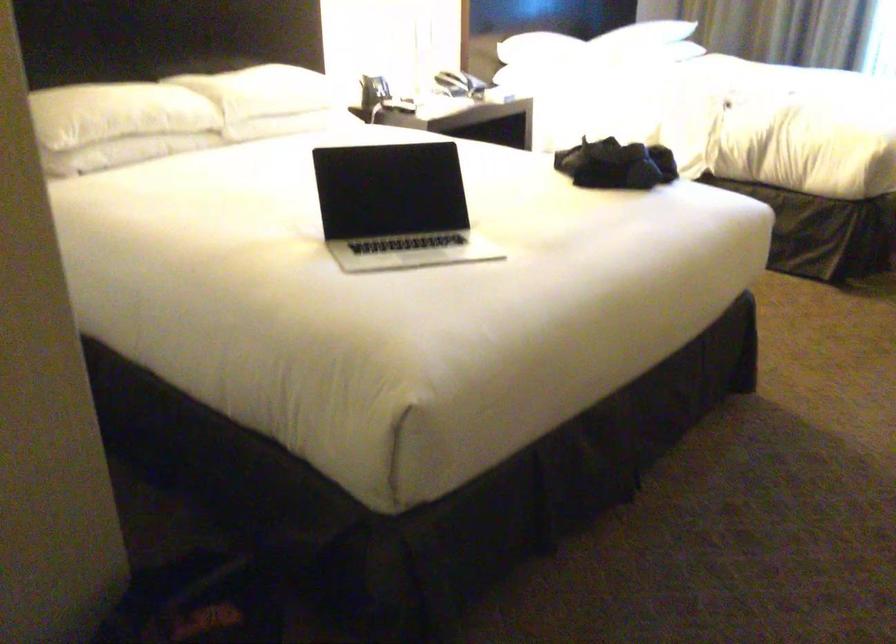
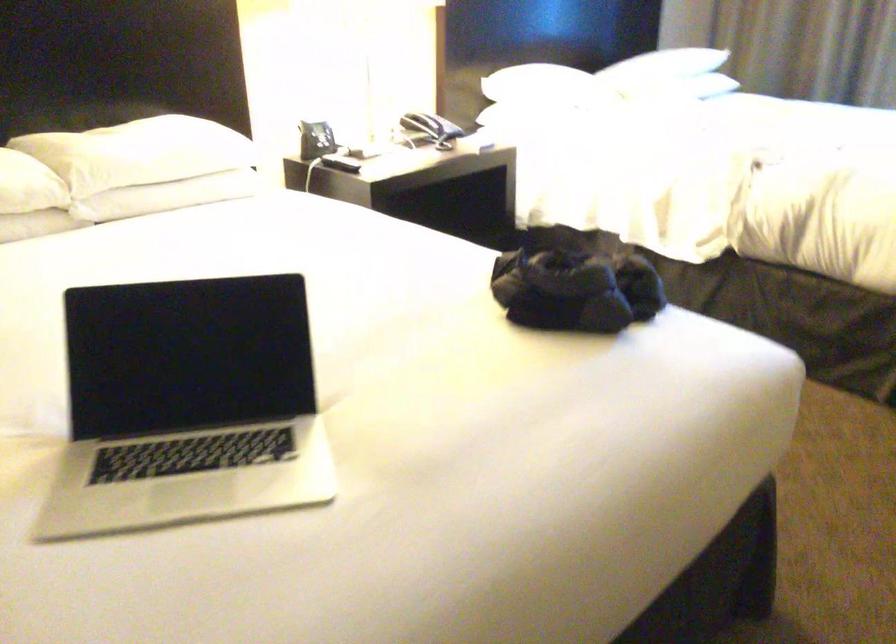
Which direction would the cameraman need to move to produce the second image?

The movement direction of the cameraman is right, forward.